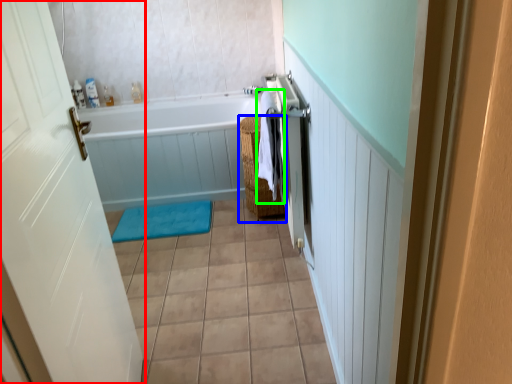
Question: Estimate the real-world distances between objects in this image. Which object is farther from door (highlighted by a red box), basket (highlighted by a blue box) or beach towel (highlighted by a green box)?

Choices:
 (A) basket
 (B) beach towel

Answer: (A)